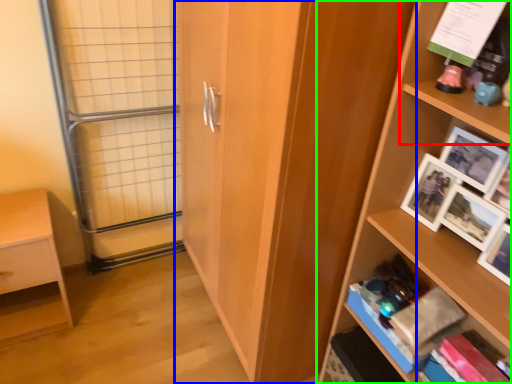
Question: Estimate the real-world distances between objects in this image. Which object is farther from shelf (highlighted by a red box), cupboard (highlighted by a blue box) or shelf (highlighted by a green box)?

Choices:
 (A) cupboard
 (B) shelf

Answer: (A)